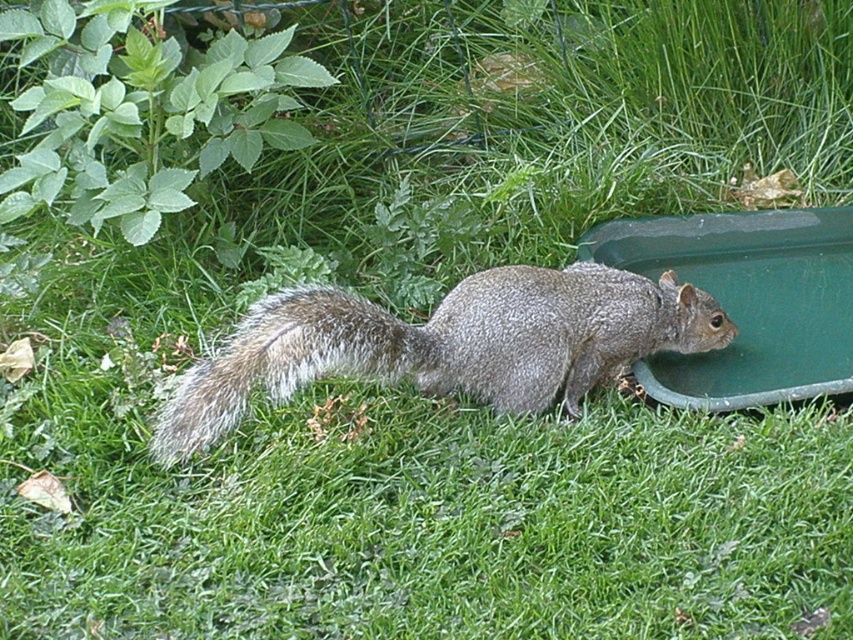
Between gray furry squirrel at center and fuzzy gray tail at center, which one has less height?

fuzzy gray tail at center

Which of these two, gray furry squirrel at center or fuzzy gray tail at center, stands taller?

With more height is gray furry squirrel at center.

Between point (305, 332) and point (225, 417), which one is positioned in front?

Point (225, 417) is more forward.

Locate an element on the screen. The height and width of the screenshot is (640, 853). gray furry squirrel at center is located at coordinates (445, 342).

Looking at this image, between green plastic tray at lower right and fuzzy gray tail at center, which one is positioned lower?

fuzzy gray tail at center is below.

Which is more to the right, green plastic tray at lower right or fuzzy gray tail at center?

From the viewer's perspective, green plastic tray at lower right appears more on the right side.

Who is more forward, (825, 220) or (323, 317)?

Positioned in front is point (323, 317).

Image resolution: width=853 pixels, height=640 pixels. Find the location of `green plastic tray at lower right`. green plastic tray at lower right is located at coordinates (747, 301).

Between gray furry squirrel at center and green plastic tray at lower right, which one appears on the left side from the viewer's perspective?

gray furry squirrel at center is more to the left.

Can you confirm if gray furry squirrel at center is bigger than green plastic tray at lower right?

Indeed, gray furry squirrel at center has a larger size compared to green plastic tray at lower right.

Find the location of a particular element. gray furry squirrel at center is located at coordinates (445, 342).